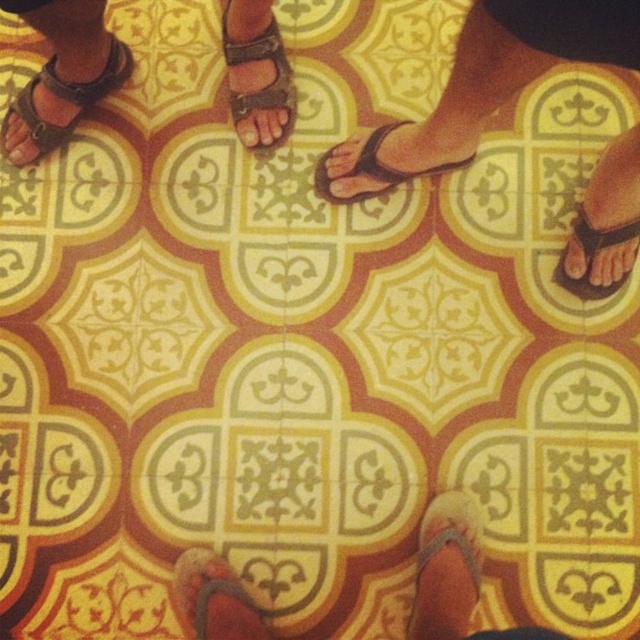
You are standing in the center of the tiled floor and want to move towards the point marked as point (67, 97). Which direction should you walk to reach the matte brown sandal at upper left?

The point (67, 97) indicates the location of the matte brown sandal at upper left, so you should walk towards the upper left direction to reach it.

You are standing on the tiled floor and see two points marked on the tiles. The first point is at coordinate point (624, 209) and the second is at point (432, 168). Which point is closer to you?

Point (624, 209) is closer to the viewer than point (432, 168).